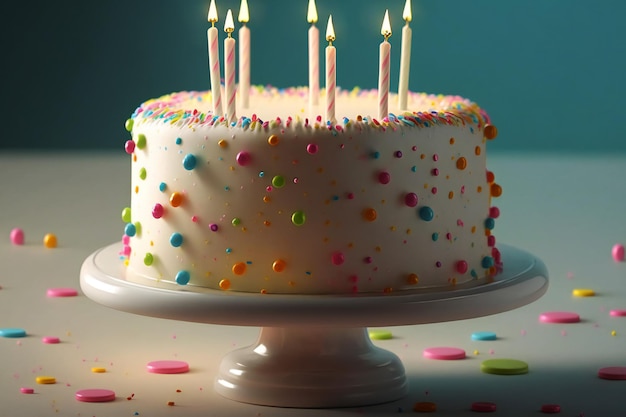
What are the coordinates of `candle flames` in the screenshot? It's located at (407, 9), (387, 30), (330, 31), (312, 11), (240, 15), (228, 30), (212, 13).